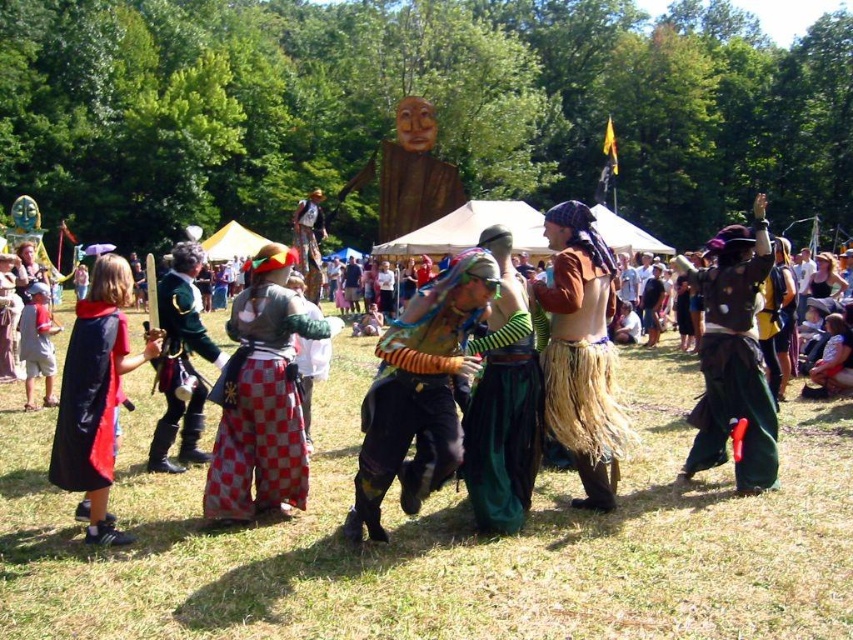
You are a festival attendee trying to take a photo with both the brown leather vest at center and the wooden figure at center. Since you want both to be fully visible in the photo, which object should you position closer to the camera?

The brown leather vest at center is not as tall as the wooden figure at center, so to ensure both are fully visible, position the brown leather vest at center closer to the camera since it is shorter and might be obscured by the taller wooden figure at center if placed farther back.

In the scene shown: What is the color of the clothing item located at the coordinates point (x=419, y=392) in the image?

The point (x=419, y=392) is on orange striped tunic at center.